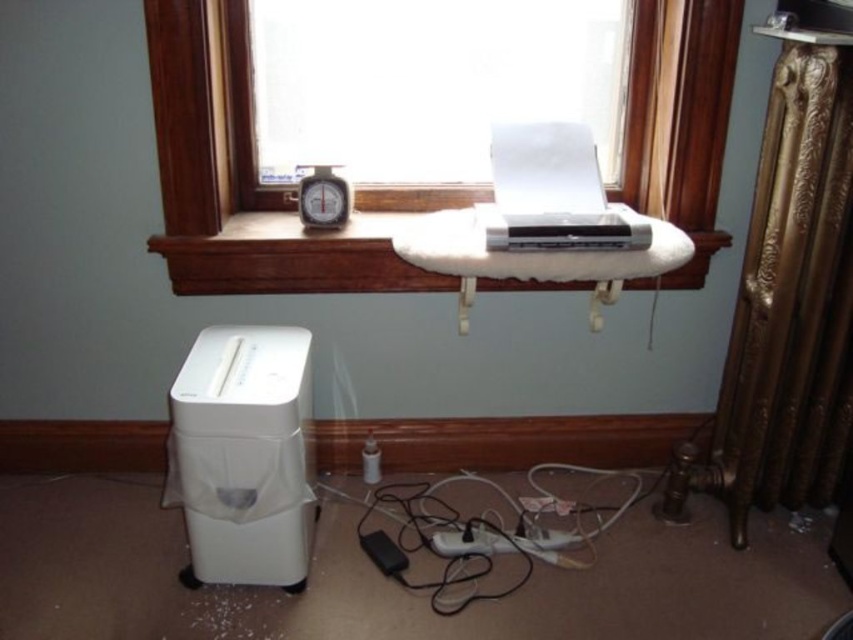
Based on the photo, you are organizing a small space and need to place a new 30 cm wide plant pot between the white plastic shredder at lower left and the black plastic alarm clock at center. Can you fit it without moving either object?

The distance between the white plastic shredder at lower left and the black plastic alarm clock at center is 52.32 centimeters. Since the plant pot is only 30 centimeters wide, there is enough space to place it between them without moving either object.

You are standing in the room and want to reach the point at coordinates point [299,566]. If you can extend your arm 1.5 meters, will you be able to touch it?

The point [299,566] is 1.64 meters from the camera, so extending your arm 1.5 meters won not reach it.